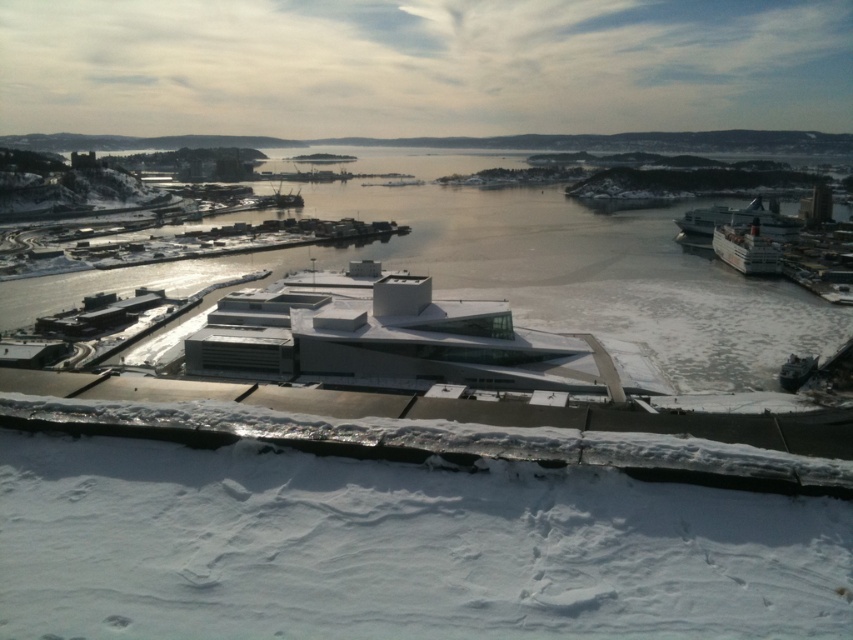
Is clear water at center further to the viewer compared to metallic gray boat at lower right?

Yes, clear water at center is further from the viewer.

Does point (764, 332) come farther from viewer compared to point (781, 372)?

Yes, it is behind point (781, 372).

Locate an element on the screen. This screenshot has width=853, height=640. clear water at center is located at coordinates (525, 276).

Does clear water at center appear on the right side of white glossy cruise ship at right?

In fact, clear water at center is to the left of white glossy cruise ship at right.

Does clear water at center lie in front of white glossy cruise ship at right?

Yes, it is in front of white glossy cruise ship at right.

Is point (135, 360) farther from viewer compared to point (757, 246)?

No, (135, 360) is closer to viewer.

Identify the location of clear water at center. (525, 276).

Does white glossy ship at right appear on the left side of metallic gray boat at lower right?

In fact, white glossy ship at right is to the right of metallic gray boat at lower right.

Is point (743, 220) farther from viewer compared to point (799, 356)?

Yes, point (743, 220) is farther from viewer.

Where is `white glossy ship at right`? The image size is (853, 640). white glossy ship at right is located at coordinates (740, 220).